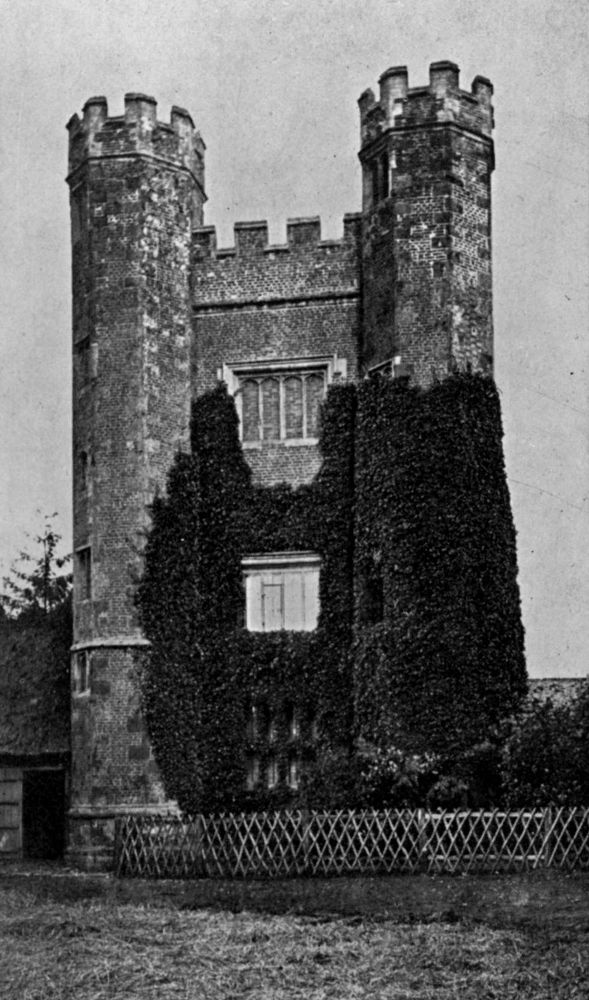
The width and height of the screenshot is (589, 1000). I want to click on walkway wall, so [x=274, y=267].